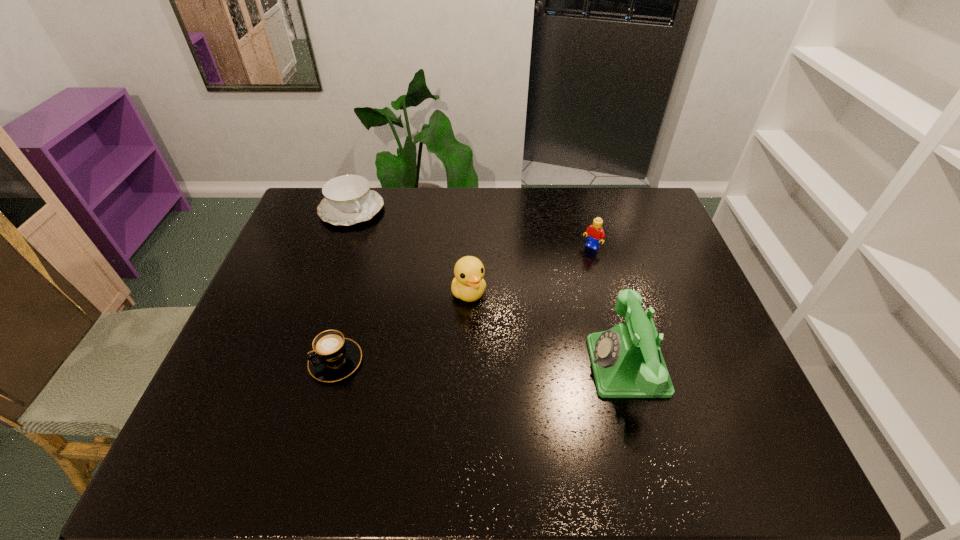
Identify the location of vacant space on the desktop that is between the cappuccino and the telephone and is positioned on the face of the second tallest object. This screenshot has width=960, height=540. (506, 364).

Locate an element on the screen. The image size is (960, 540). vacant space on the desktop that is between the cappuccino and the telephone and is positioned on the handle side of the farthest object is located at coordinates (466, 363).

At what (x,y) coordinates should I click in order to perform the action: click on free space on the desktop that is between the cappuccino and the telephone and is positioned on the front-facing side of the second farthest object. Please return your answer as a coordinate pair (x, y). Looking at the image, I should click on (481, 363).